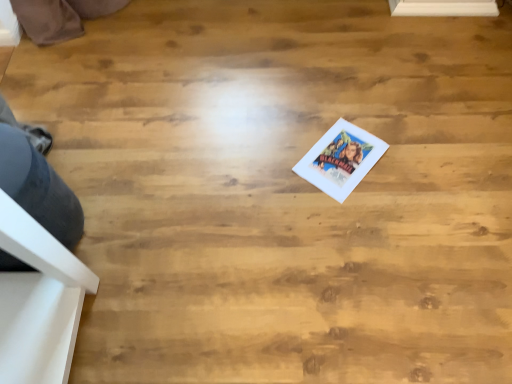
Where is `matte paper postcard at center`? This screenshot has height=384, width=512. matte paper postcard at center is located at coordinates (341, 159).

What do you see at coordinates (341, 159) in the screenshot? I see `matte paper postcard at center` at bounding box center [341, 159].

Find the location of a particular element. This screenshot has width=512, height=384. gray fabric shoe at lower left is located at coordinates (37, 179).

Describe the element at coordinates (37, 179) in the screenshot. I see `gray fabric shoe at lower left` at that location.

Identify the location of matte paper postcard at center. (341, 159).

Between gray fabric shoe at lower left and matte paper postcard at center, which one appears on the left side from the viewer's perspective?

Positioned to the left is gray fabric shoe at lower left.

Which is in front, gray fabric shoe at lower left or matte paper postcard at center?

gray fabric shoe at lower left is closer to the camera.

Does point (47, 201) appear closer or farther from the camera than point (351, 154)?

Point (47, 201) is closer to the camera than point (351, 154).

From the image's perspective, is gray fabric shoe at lower left on top of matte paper postcard at center?

No, from the image's perspective, gray fabric shoe at lower left is not over matte paper postcard at center.

From a real-world perspective, is gray fabric shoe at lower left positioned under matte paper postcard at center based on gravity?

Actually, gray fabric shoe at lower left is physically above matte paper postcard at center in the real world.

Between gray fabric shoe at lower left and matte paper postcard at center, which one has smaller width?

Thinner between the two is matte paper postcard at center.

From the picture: In terms of height, does gray fabric shoe at lower left look taller or shorter compared to matte paper postcard at center?

gray fabric shoe at lower left is taller than matte paper postcard at center.

Considering the sizes of gray fabric shoe at lower left and matte paper postcard at center in the image, is gray fabric shoe at lower left bigger or smaller than matte paper postcard at center?

Considering their sizes, gray fabric shoe at lower left takes up more space than matte paper postcard at center.

Is gray fabric shoe at lower left situated inside matte paper postcard at center or outside?

gray fabric shoe at lower left is located beyond the bounds of matte paper postcard at center.

Are gray fabric shoe at lower left and matte paper postcard at center far apart?

gray fabric shoe at lower left is actually quite close to matte paper postcard at center.

Is matte paper postcard at center at the back of gray fabric shoe at lower left?

No, gray fabric shoe at lower left's orientation is not away from matte paper postcard at center.

Looking at this image, how different are the orientations of gray fabric shoe at lower left and matte paper postcard at center in degrees?

They differ by 132 degrees in their facing directions.

Where is `person above the matte paper postcard at center (from a real-world perspective)`? This screenshot has width=512, height=384. person above the matte paper postcard at center (from a real-world perspective) is located at coordinates (37, 179).

Looking at this image, which is more to the right, matte paper postcard at center or gray fabric shoe at lower left?

matte paper postcard at center is more to the right.

Looking at this image, which object is more forward, matte paper postcard at center or gray fabric shoe at lower left?

gray fabric shoe at lower left is more forward.

Which point is more distant from viewer, (353, 187) or (30, 159)?

The point (353, 187) is farther.

From the image's perspective, relative to gray fabric shoe at lower left, is matte paper postcard at center above or below?

Based on their image positions, matte paper postcard at center is located above gray fabric shoe at lower left.

From a real-world perspective, which is physically above, matte paper postcard at center or gray fabric shoe at lower left?

gray fabric shoe at lower left.

Consider the image. Between matte paper postcard at center and gray fabric shoe at lower left, which one has larger width?

gray fabric shoe at lower left is wider.

Between matte paper postcard at center and gray fabric shoe at lower left, which one has more height?

gray fabric shoe at lower left is taller.

Considering the relative sizes of matte paper postcard at center and gray fabric shoe at lower left in the image provided, is matte paper postcard at center smaller than gray fabric shoe at lower left?

Indeed, matte paper postcard at center has a smaller size compared to gray fabric shoe at lower left.

Is gray fabric shoe at lower left inside matte paper postcard at center?

No, gray fabric shoe at lower left is not a part of matte paper postcard at center.

Would you consider matte paper postcard at center to be distant from gray fabric shoe at lower left?

They are positioned close to each other.

Does matte paper postcard at center turn towards gray fabric shoe at lower left?

No.

How many degrees apart are the facing directions of matte paper postcard at center and gray fabric shoe at lower left?

matte paper postcard at center and gray fabric shoe at lower left are facing 132 degrees away from each other.

Measure the distance from matte paper postcard at center to gray fabric shoe at lower left.

They are 84.53 centimeters apart.

Locate an element on the screen. person above the matte paper postcard at center (from a real-world perspective) is located at coordinates (37, 179).

Identify the location of postcard behind the gray fabric shoe at lower left. This screenshot has height=384, width=512. pos(341,159).

At what (x,y) coordinates should I click in order to perform the action: click on postcard that appears below the gray fabric shoe at lower left (from a real-world perspective). Please return your answer as a coordinate pair (x, y). The height and width of the screenshot is (384, 512). Looking at the image, I should click on (341, 159).